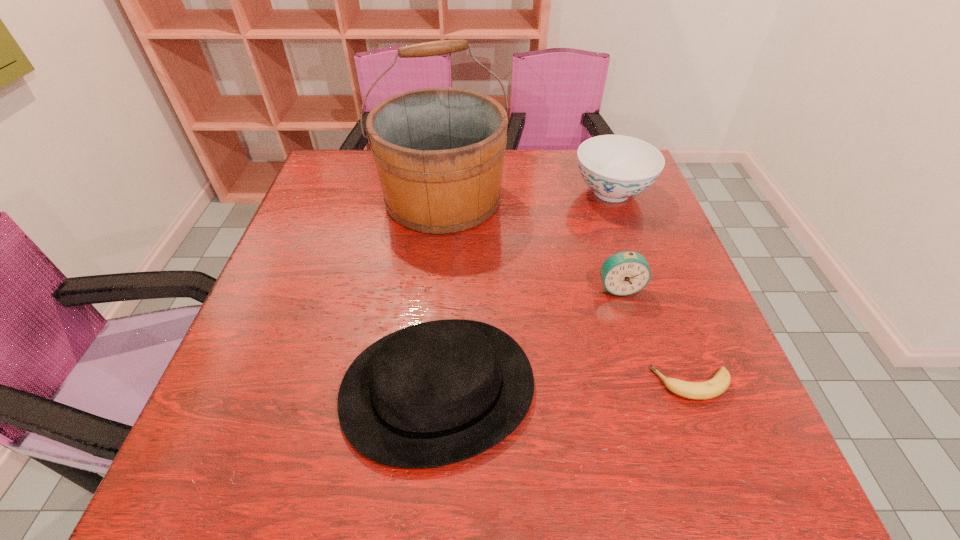
Locate an element on the screen. The width and height of the screenshot is (960, 540). empty space that is in between the chinaware and the fedora is located at coordinates (525, 291).

In order to click on vacant space that is in between the fedora and the alarm clock in this screenshot , I will do `click(528, 338)`.

Image resolution: width=960 pixels, height=540 pixels. I want to click on vacant area between the bucket and the chinaware, so click(527, 195).

The height and width of the screenshot is (540, 960). In order to click on vacant area between the fedora and the third nearest object in this screenshot , I will do `click(528, 338)`.

Find the location of a particular element. free spot between the alarm clock and the fedora is located at coordinates (528, 338).

This screenshot has height=540, width=960. Find the location of `object that is the fourth closest to the fedora`. object that is the fourth closest to the fedora is located at coordinates (616, 167).

Find the location of a particular element. object that is the nearest to the chinaware is located at coordinates (439, 152).

Image resolution: width=960 pixels, height=540 pixels. In order to click on vacant position in the image that satisfies the following two spatial constraints: 1. on the back side of the chinaware; 2. on the left side of the bucket in this screenshot , I will do `click(444, 192)`.